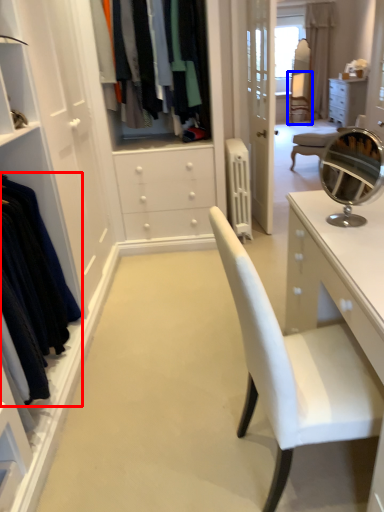
Question: Which of the following is the farthest to the observer, clothing (highlighted by a red box) or armchair (highlighted by a blue box)?

Choices:
 (A) clothing
 (B) armchair

Answer: (B)